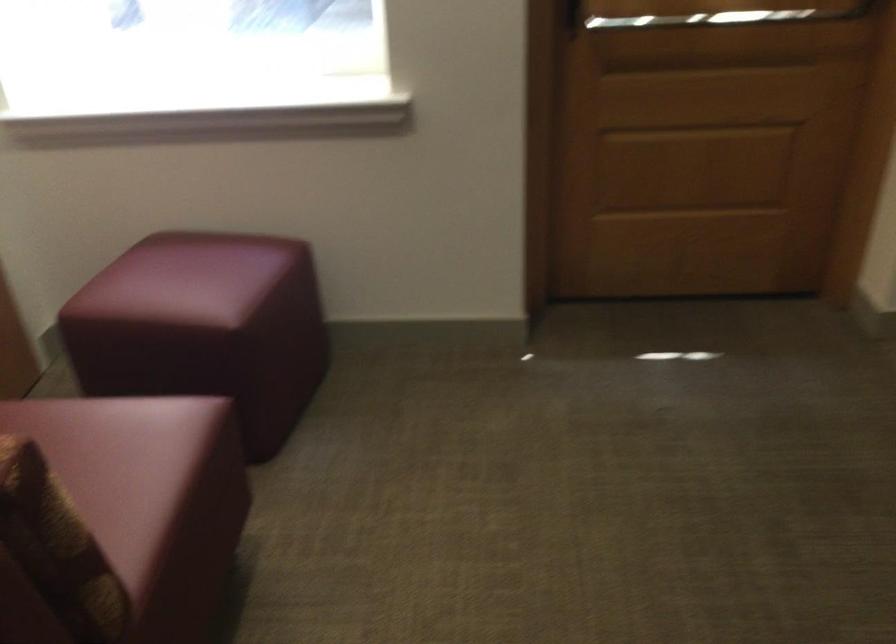
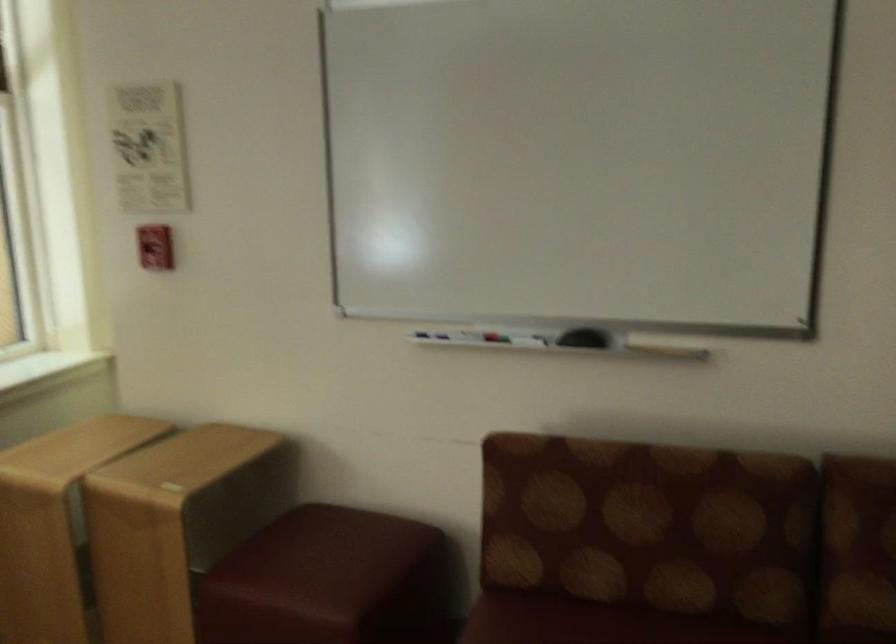
Question: The camera is either moving clockwise (left) or counter-clockwise (right) around the object. The first image is from the beginning of the video and the second image is from the end. Is the camera moving left or right when shooting the video?

Choices:
 (A) Left
 (B) Right

Answer: (A)